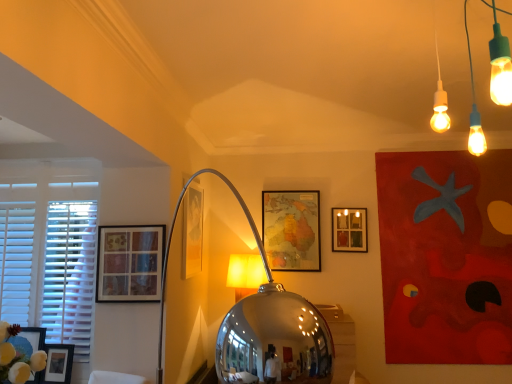
Question: Which is correct: matte black picture frame at lower left, acting as the first picture frame starting from the left, is inside matte glass picture frame at upper center, the 2th picture frame positioned from the back, or outside of it?

Choices:
 (A) inside
 (B) outside

Answer: (B)

Question: Is point (51, 367) positioned closer to the camera than point (355, 233)?

Choices:
 (A) farther
 (B) closer

Answer: (B)

Question: Considering the real-world distances, which object is farthest from the matte glass picture frame at upper center, the 2th picture frame positioned from the back?

Choices:
 (A) white matte window at left
 (B) matte glass picture frame at left, arranged as the 5th picture frame when viewed from the back
 (C) matte wooden map at center, which ranks as the 5th picture frame in front-to-back order
 (D) matte glass picture frame at center, marked as the 3th picture frame in a back-to-front arrangement
 (E) matte black picture frame at lower left, which is the fourth picture frame in back-to-front order

Answer: (E)

Question: Considering the real-world distances, which object is closest to the matte wooden map at center, the 1th picture frame from the back?

Choices:
 (A) matte black picture frame at lower left, which is the fourth picture frame in back-to-front order
 (B) white matte window at left
 (C) matte glass picture frame at left, the 1th picture frame from the front
 (D) shiny metallic table lamp at center
 (E) matte glass picture frame at upper center, the fifth picture frame in the left-to-right sequence

Answer: (E)